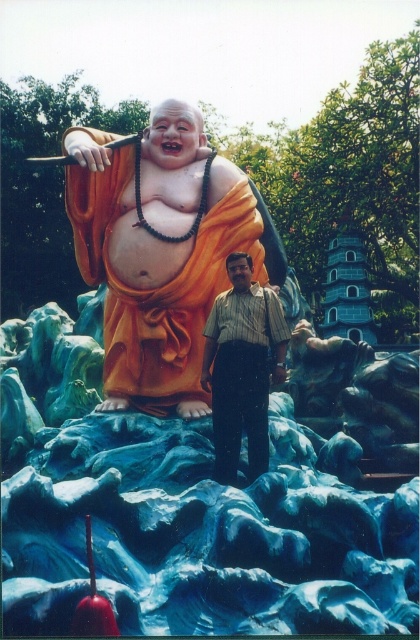
Who is more distant from viewer, (x=260, y=250) or (x=204, y=369)?

The point (x=260, y=250) is behind.

Is point (186, 388) in front of point (222, 321)?

No, (186, 388) is further to viewer.

Locate an element on the screen. This screenshot has width=420, height=640. orange matte statue at center is located at coordinates (154, 273).